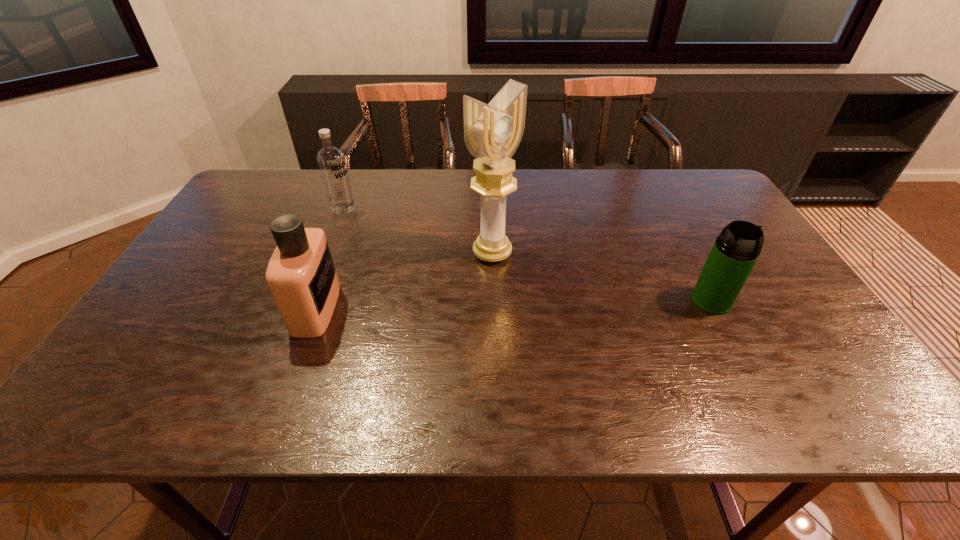
I want to click on vacant space that satisfies the following two spatial constraints: 1. on the front side of the perfume; 2. on the front label of the vodka, so click(303, 308).